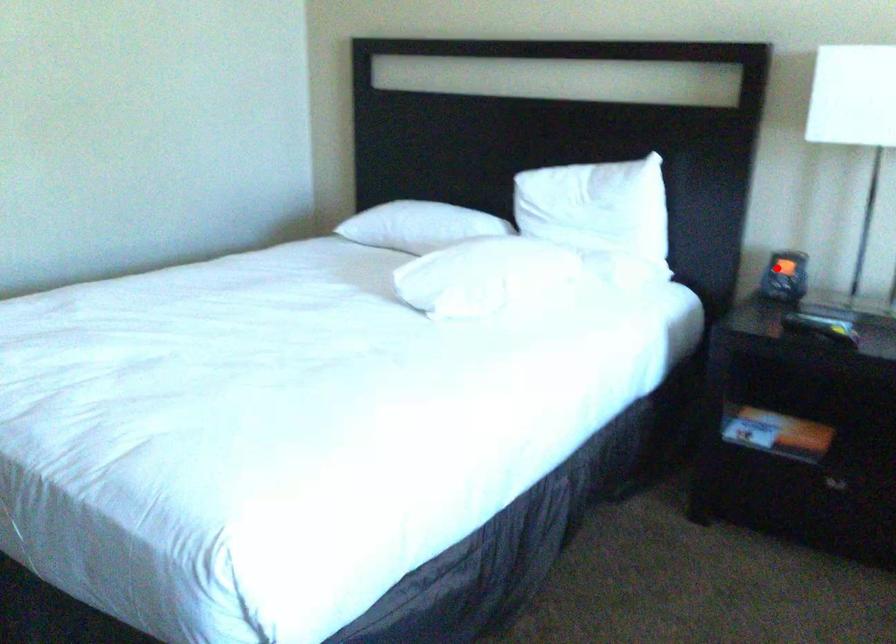
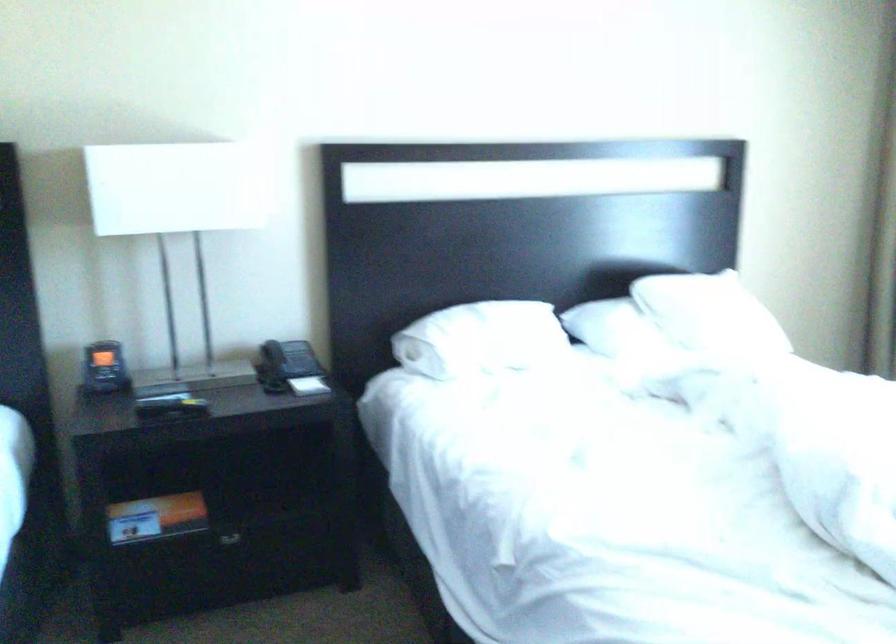
Locate, in the second image, the point that corresponds to the highlighted location in the first image.

(104, 368)